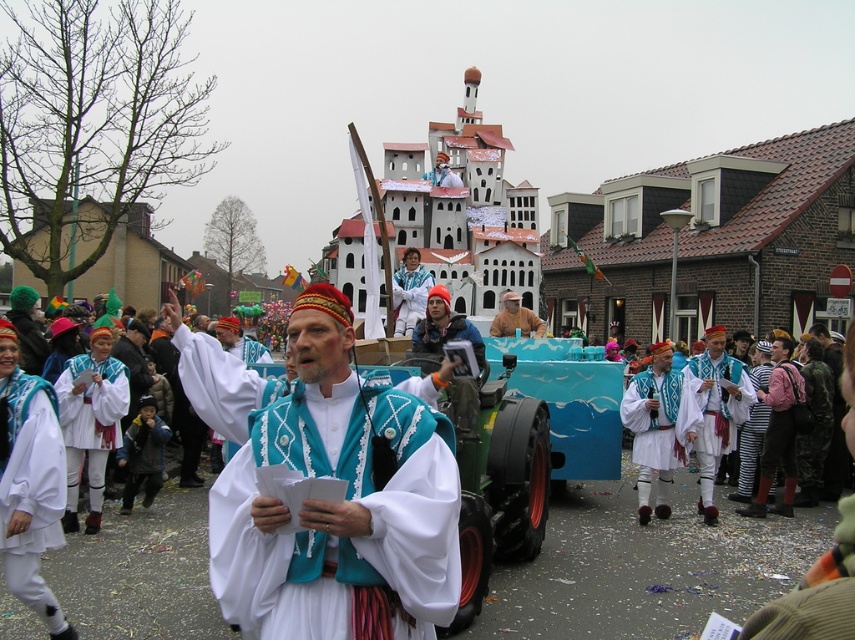
You are a photographer trying to capture the man in the white cotton outfit at center and striped fabric pants at center. Since you want to focus on the outfit, should you adjust your camera to focus on the closer object or the farther one?

The white cotton outfit at center is closer to the viewer than striped fabric pants at center. To focus on the outfit, adjust your camera to focus on the closer object.

You are a photographer standing at the camera position. You want to take a closeup shot of the white cotton pants at lower left. Considering the distance, is it possible to capture the pants clearly without moving closer?

The white cotton pants at lower left is 89.67 feet away from camera. At this distance, capturing a clear closeup shot without moving closer may be challenging due to the significant distance involved.